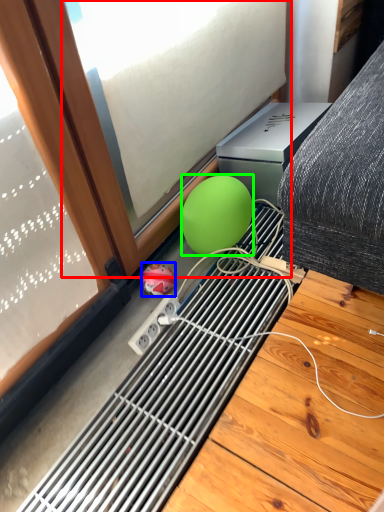
Question: Which object is the closest to the window (highlighted by a red box)? Choose among these: ball (highlighted by a blue box) or ball (highlighted by a green box).

Choices:
 (A) ball
 (B) ball

Answer: (B)